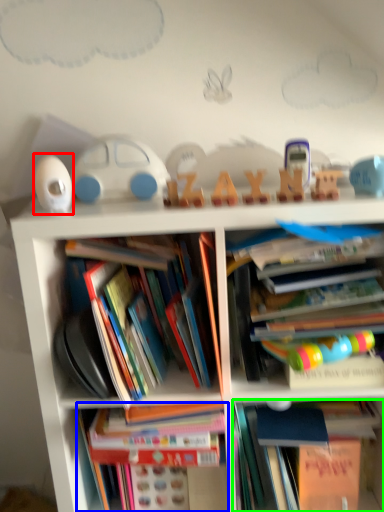
Question: Which is nearer to the toy (highlighted by a red box)? book (highlighted by a blue box) or book (highlighted by a green box).

Choices:
 (A) book
 (B) book

Answer: (A)